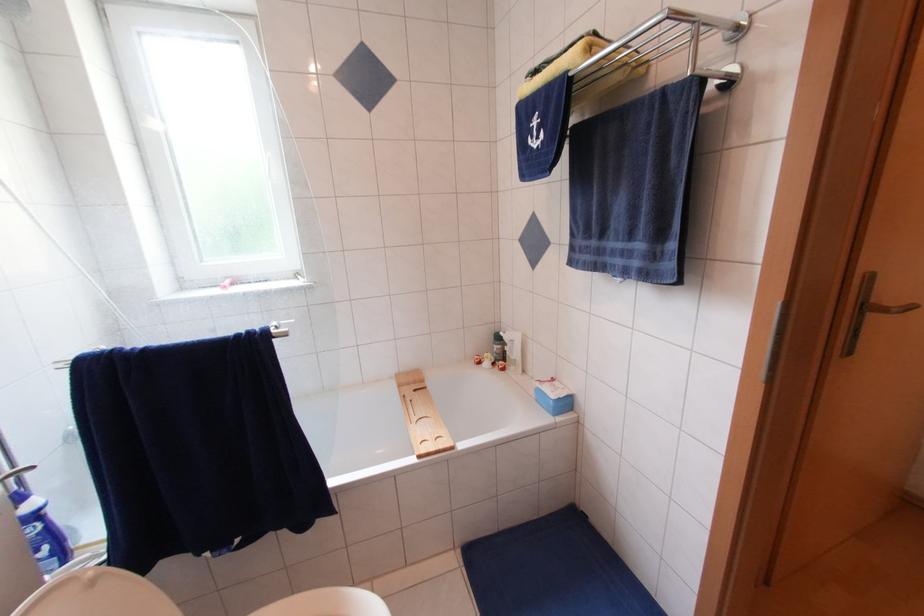
Locate an element on the screen. towel rack bar is located at coordinates (280, 329).